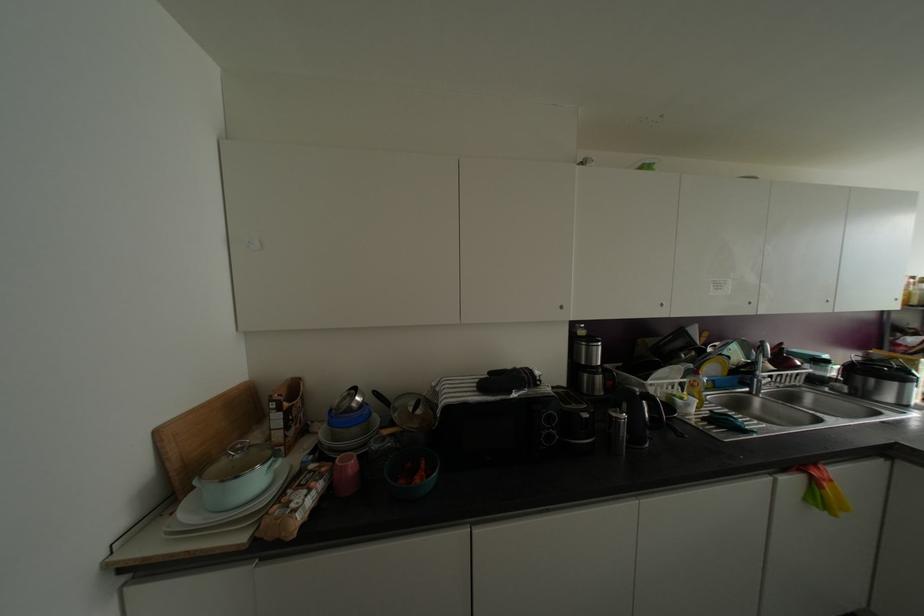
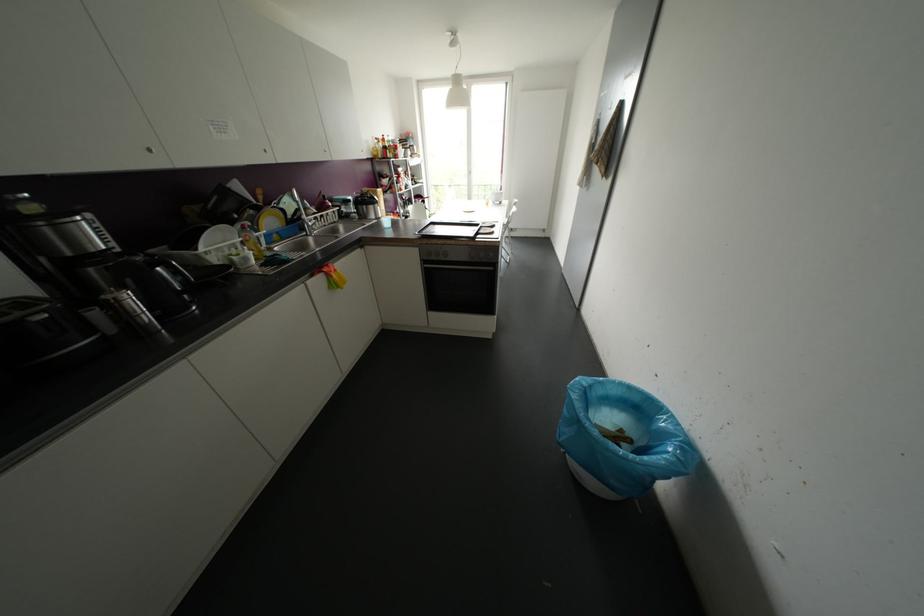
Based on the continuous images, in which direction is the camera rotating?

The rotation direction of the camera is right-down.